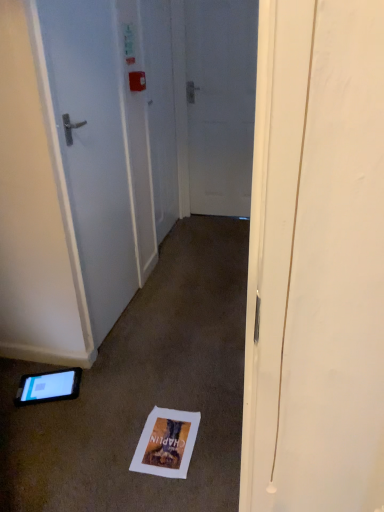
Locate an element on the screen. The height and width of the screenshot is (512, 384). vacant space to the right of white paper postcard at lower center is located at coordinates (213, 454).